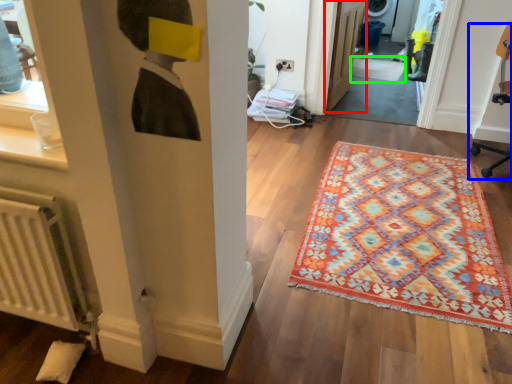
Question: Which is nearer to the door (highlighted by a red box)? swivel chair (highlighted by a blue box) or doormat (highlighted by a green box).

Choices:
 (A) swivel chair
 (B) doormat

Answer: (B)